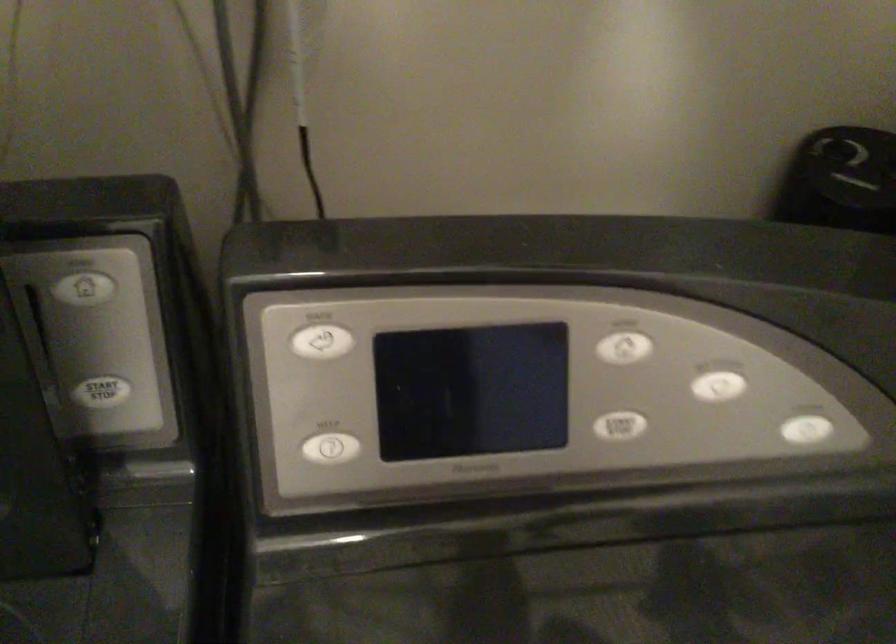
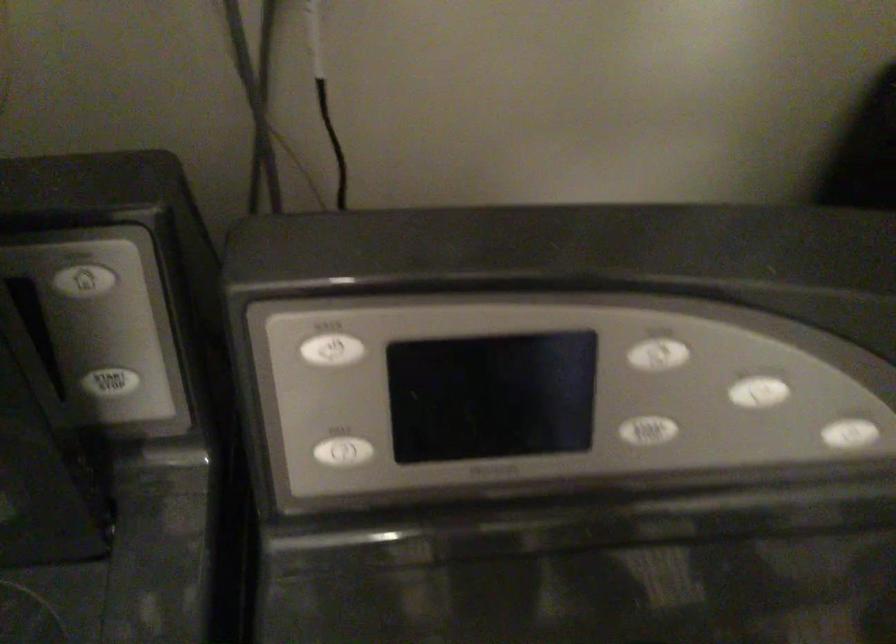
Question: In a continuous first-person perspective shot, in which direction is the camera moving?

Choices:
 (A) Left
 (B) Right
 (C) Forward
 (D) Backward

Answer: (C)